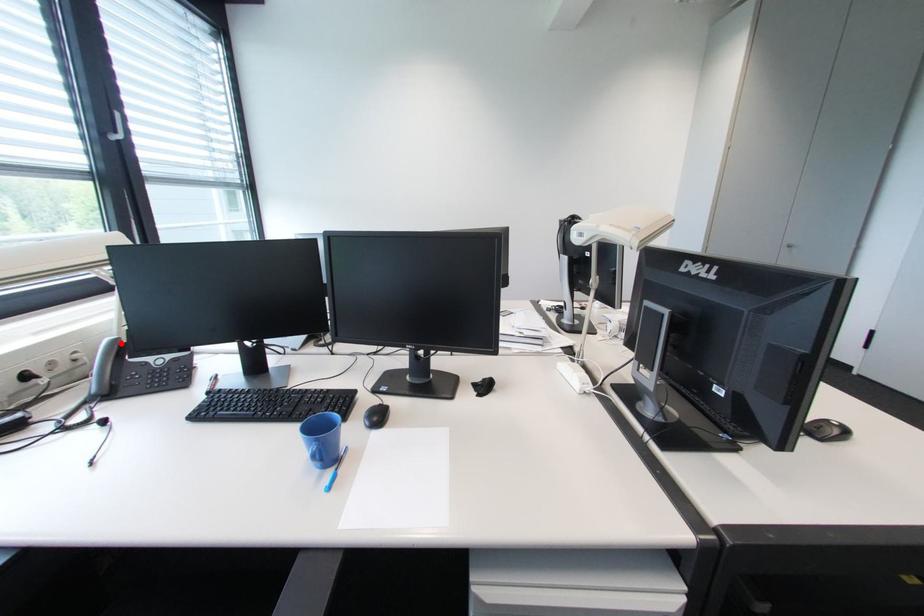
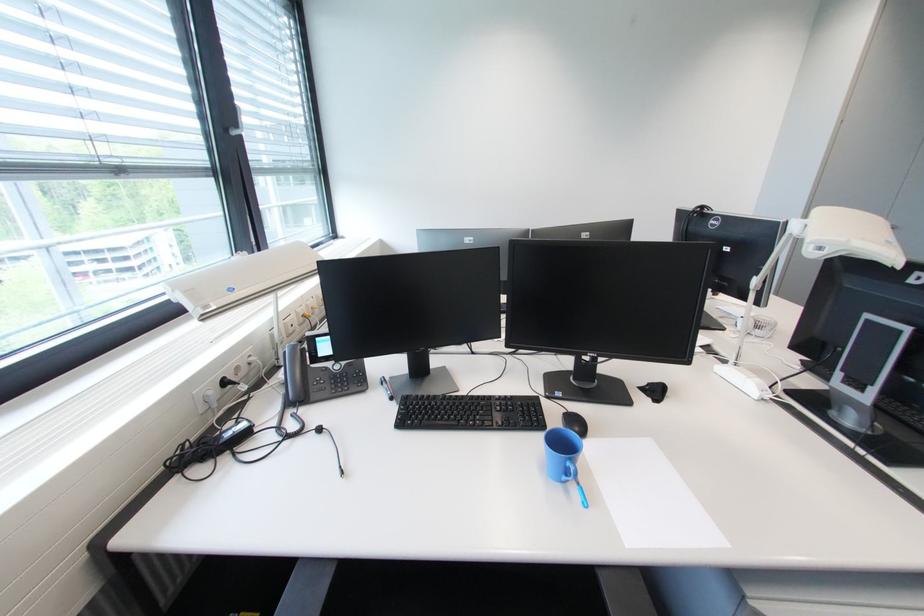
Find the pixel in the second image that matches the highlighted location in the first image.

(300, 349)